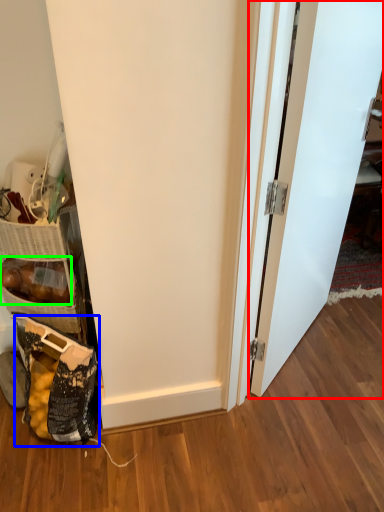
Question: Which is nearer to the door (highlighted by a red box)? material (highlighted by a blue box) or stuff (highlighted by a green box).

Choices:
 (A) material
 (B) stuff

Answer: (A)